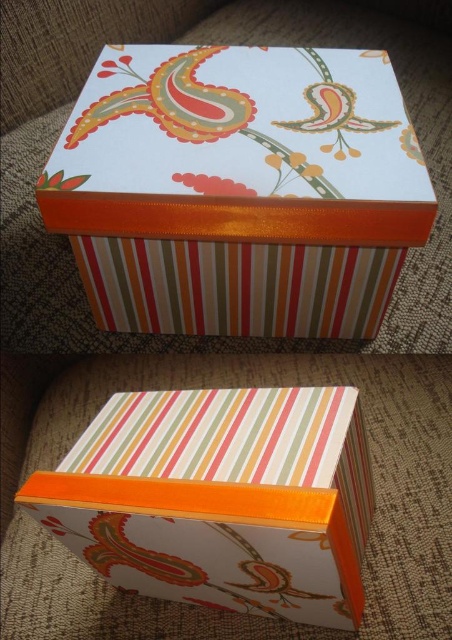
Is matte paper box at center further to camera compared to matte striped box at center?

Yes, it is behind matte striped box at center.

Can you confirm if matte paper box at center is taller than matte striped box at center?

Yes, matte paper box at center is taller than matte striped box at center.

Describe the element at coordinates (239, 189) in the screenshot. This screenshot has width=452, height=640. I see `matte paper box at center` at that location.

Identify the location of matte paper box at center. The width and height of the screenshot is (452, 640). (239, 189).